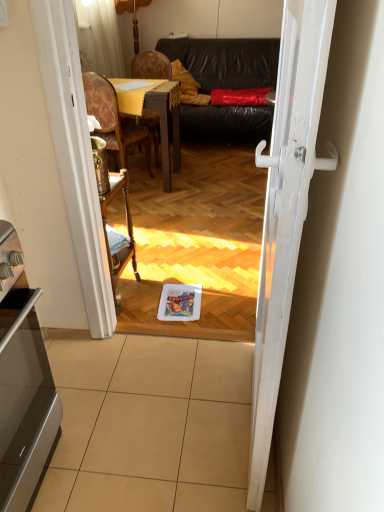
Where is `vacant space in front of woodenchair at center, marked as the 2th chair in a back-to-front arrangement`? The image size is (384, 512). vacant space in front of woodenchair at center, marked as the 2th chair in a back-to-front arrangement is located at coordinates (142, 201).